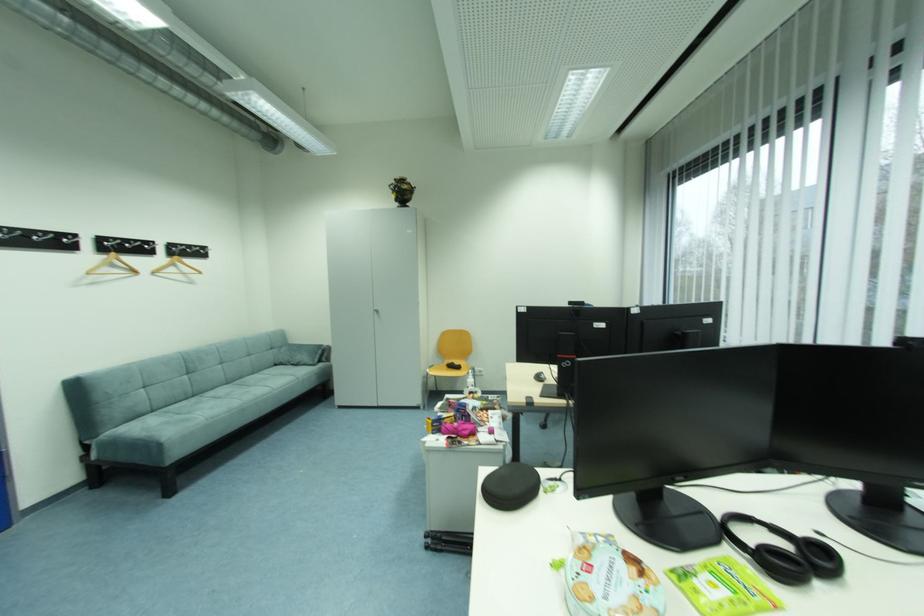
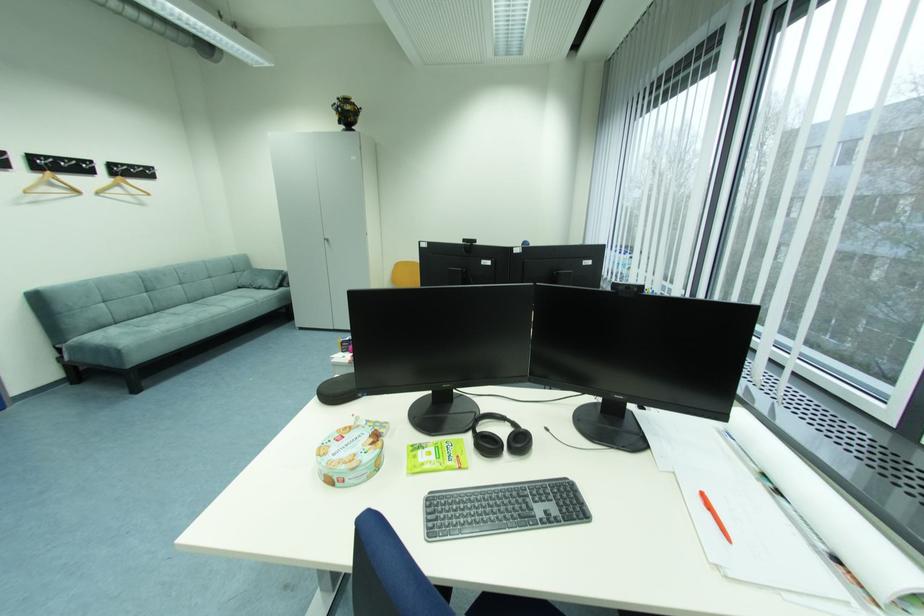
Question: I am providing you with two images of the same scene from different viewpoints. After the viewpoint changes to image2, which objects are now occluded?

Choices:
 (A) cabinet door handle
 (B) sofa sitting surface
 (C) round cookie tin
 (D) none of these

Answer: (D)